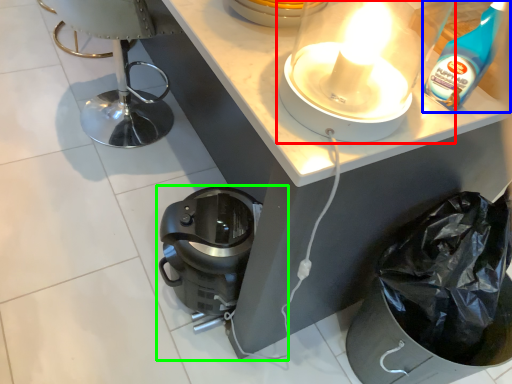
Question: Which object is the farthest from kitchen appliance (highlighted by a red box)? Choose among these: cleaning product (highlighted by a blue box) or home appliance (highlighted by a green box).

Choices:
 (A) cleaning product
 (B) home appliance

Answer: (B)